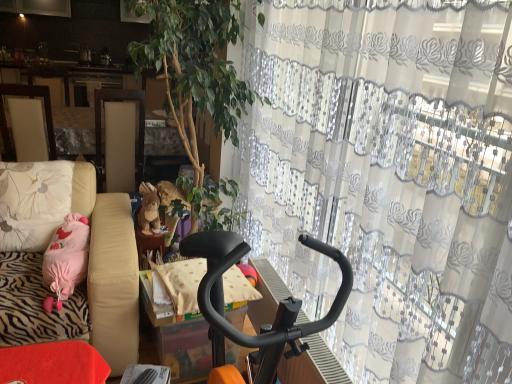
What do you see at coordinates (279, 303) in the screenshot?
I see `black plastic exercise bike at center` at bounding box center [279, 303].

You are a GUI agent. You are given a task and a screenshot of the screen. Output one action in this format:
    pyautogui.click(x=<x>, y=<y>)
    Task: Click on the matte wood screen door at center
    The width and height of the screenshot is (512, 384).
    Given the screenshot: What is the action you would take?
    pyautogui.click(x=101, y=119)

Measure the distance between point [172,266] and camera.

The depth of point [172,266] is 6.05 feet.

Describe the element at coordinates (33, 202) in the screenshot. I see `pink fabric pillow at left` at that location.

Image resolution: width=512 pixels, height=384 pixels. What do you see at coordinates (108, 267) in the screenshot?
I see `pink fabric pillow at left` at bounding box center [108, 267].

In order to face brown plush rabbit at center, should I rotate leftwards or rightwards?

To align with it, rotate left about 13.770°.

In order to click on black plastic exercise bike at center in this screenshot , I will do `click(279, 303)`.

From the picture: Which is more to the right, matte wood screen door at center or black plastic exercise bike at center?

black plastic exercise bike at center.

In the scene shown: How different are the orientations of matte wood screen door at center and black plastic exercise bike at center in degrees?

The angle between the facing direction of matte wood screen door at center and the facing direction of black plastic exercise bike at center is 88.4 degrees.

Considering the sizes of objects matte wood screen door at center and black plastic exercise bike at center in the image provided, who is taller, matte wood screen door at center or black plastic exercise bike at center?

black plastic exercise bike at center.

Is pink fabric pillow at left not within black textured cushion at center?

Yes, pink fabric pillow at left is located beyond the bounds of black textured cushion at center.

How different are the orientations of pink fabric pillow at left and black textured cushion at center in degrees?

The facing directions of pink fabric pillow at left and black textured cushion at center are 81.9 degrees apart.

Does pink fabric pillow at left have a larger size compared to black textured cushion at center?

Correct, pink fabric pillow at left is larger in size than black textured cushion at center.

Is black textured cushion at center wider than matte wood screen door at center?

Incorrect, the width of black textured cushion at center does not surpass that of matte wood screen door at center.

Are black textured cushion at center and matte wood screen door at center located far from each other?

That's right, there is a large distance between black textured cushion at center and matte wood screen door at center.

Is black textured cushion at center inside the boundaries of matte wood screen door at center, or outside?

black textured cushion at center lies outside matte wood screen door at center.

Considering the positions of point (181, 310) and point (140, 164), is point (181, 310) closer or farther from the camera than point (140, 164)?

Clearly, point (181, 310) is closer to the camera than point (140, 164).

Is green leafy plant at center placed right next to black textured cushion at center?

No, green leafy plant at center is not with black textured cushion at center.

Would you say black textured cushion at center is part of green leafy plant at center's contents?

No, green leafy plant at center does not contain black textured cushion at center.

Which object is further away from the camera taking this photo, green leafy plant at center or black textured cushion at center?

black textured cushion at center is further from the camera.

Can you tell me how much green leafy plant at center and black textured cushion at center differ in facing direction?

The angle between the facing direction of green leafy plant at center and the facing direction of black textured cushion at center is 4.99 degrees.

Based on the photo, can we say pink fabric pillow at left lies outside matte wood screen door at center?

pink fabric pillow at left lies outside matte wood screen door at center's area.

Is pink fabric pillow at left bigger or smaller than matte wood screen door at center?

Clearly, pink fabric pillow at left is larger in size than matte wood screen door at center.

Is pink fabric pillow at left wider or thinner than matte wood screen door at center?

In the image, pink fabric pillow at left appears to be wider than matte wood screen door at center.

Would you consider pink fabric pillow at left to be distant from matte wood screen door at center?

Indeed, pink fabric pillow at left is not near matte wood screen door at center.

Considering the relative positions of matte wood screen door at center and pink fabric pillow at left in the image provided, is matte wood screen door at center to the left or to the right of pink fabric pillow at left?

From the image, it's evident that matte wood screen door at center is to the left of pink fabric pillow at left.

From the image's perspective, does matte wood screen door at center appear lower than pink fabric pillow at left?

No, from the image's perspective, matte wood screen door at center is not below pink fabric pillow at left.

Could you tell me if matte wood screen door at center is facing pink fabric pillow at left?

No, matte wood screen door at center does not turn towards pink fabric pillow at left.

Is matte wood screen door at center positioned far away from pink fabric pillow at left?

matte wood screen door at center is positioned a significant distance from pink fabric pillow at left.

Considering the sizes of objects brown plush rabbit at center and black plastic exercise bike at center in the image provided, who is bigger, brown plush rabbit at center or black plastic exercise bike at center?

black plastic exercise bike at center is bigger.

Which point is more forward, (x=153, y=197) or (x=291, y=300)?

Point (x=291, y=300)

Which is more to the right, brown plush rabbit at center or black plastic exercise bike at center?

Positioned to the right is black plastic exercise bike at center.

Are brown plush rabbit at center and black plastic exercise bike at center far apart?

Absolutely, brown plush rabbit at center is distant from black plastic exercise bike at center.

The width and height of the screenshot is (512, 384). What are the coordinates of `baby carriage beneath the matte wood screen door at center (from a real-world perspective)` in the screenshot? It's located at (279, 303).

Locate an element on the screen. The width and height of the screenshot is (512, 384). furniture in front of the black textured cushion at center is located at coordinates (108, 267).

Based on their spatial positions, is green leafy plant at center or pink fabric pillow at left further from black plastic exercise bike at center?

The object further to black plastic exercise bike at center is green leafy plant at center.

Which object lies further to the anchor point pink fabric pillow at left, brown plush rabbit at center or black plastic exercise bike at center?

Among the two, black plastic exercise bike at center is located further to pink fabric pillow at left.

Which object lies nearer to the anchor point matte wood screen door at center, pink fabric pillow at left or black plastic exercise bike at center?

pink fabric pillow at left is closer to matte wood screen door at center.

In the scene shown: Estimate the real-world distances between objects in this image. Which object is further from pink fabric pillow at left, black plastic exercise bike at center or black textured cushion at center?

black plastic exercise bike at center.

Considering their positions, is brown plush rabbit at center positioned further to green leafy plant at center than pink fabric pillow at left?

pink fabric pillow at left.

From the image, which object appears to be nearer to black textured cushion at center, matte wood screen door at center or pink fabric pillow at left?

pink fabric pillow at left is positioned closer to the anchor black textured cushion at center.

In the scene shown: Looking at the image, which one is located closer to pink fabric pillow at left, black plastic exercise bike at center or brown plush rabbit at center?

Among the two, brown plush rabbit at center is located nearer to pink fabric pillow at left.

From the image, which object appears to be nearer to black textured cushion at center, matte wood screen door at center or pink fabric pillow at left?

Based on the image, pink fabric pillow at left appears to be nearer to black textured cushion at center.

Locate an element on the screen. The image size is (512, 384). material that lies between green leafy plant at center and black plastic exercise bike at center from top to bottom is located at coordinates (182, 282).

Identify the location of plant between pink fabric pillow at left and black plastic exercise bike at center in the horizontal direction. This screenshot has height=384, width=512. (195, 65).

Locate an element on the screen. Image resolution: width=512 pixels, height=384 pixels. material between pink fabric pillow at left and brown plush rabbit at center along the z-axis is located at coordinates pyautogui.click(x=182, y=282).

Identify the location of plant between black plastic exercise bike at center and matte wood screen door at center from front to back. (195, 65).